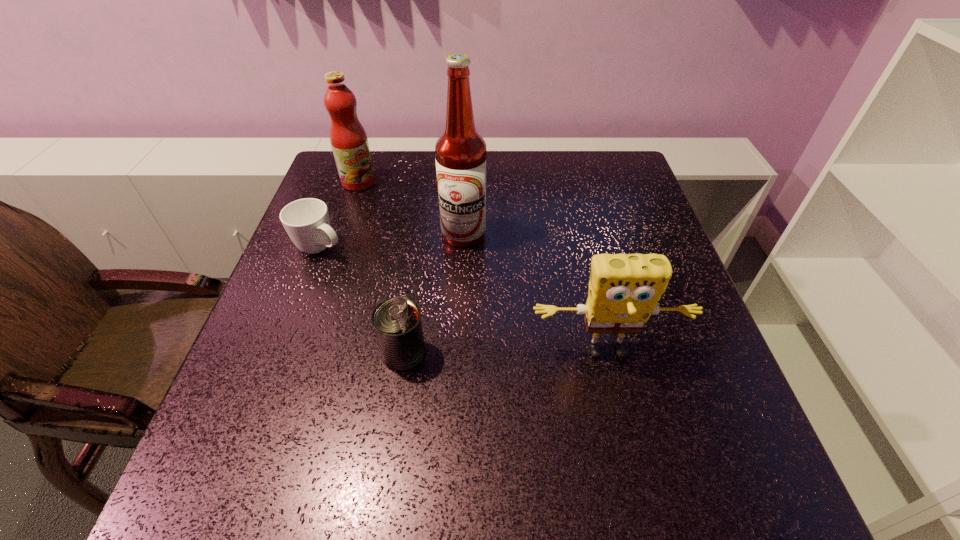
What are the coordinates of `the third object from left to right` in the screenshot? It's located at (397, 324).

The width and height of the screenshot is (960, 540). I want to click on can, so click(397, 324).

Where is `the third shortest object`? the third shortest object is located at coordinates click(x=624, y=289).

Locate an element on the screen. Image resolution: width=960 pixels, height=540 pixels. sponge is located at coordinates (624, 289).

You are a GUI agent. You are given a task and a screenshot of the screen. Output one action in this format:
    pyautogui.click(x=<x>, y=<y>)
    Task: Click on the tallest object
    Image resolution: width=960 pixels, height=540 pixels.
    Given the screenshot: What is the action you would take?
    pyautogui.click(x=460, y=152)

Find the location of a particular element. This screenshot has height=540, width=960. alcohol is located at coordinates (460, 152).

Where is `the shortest object`? the shortest object is located at coordinates (307, 222).

Find the location of a particular element. This screenshot has height=540, width=960. the second tallest object is located at coordinates (349, 142).

Where is `the farthest object`? This screenshot has height=540, width=960. the farthest object is located at coordinates (349, 142).

The width and height of the screenshot is (960, 540). What are the coordinates of `free space located on the left of the can` in the screenshot? It's located at (277, 353).